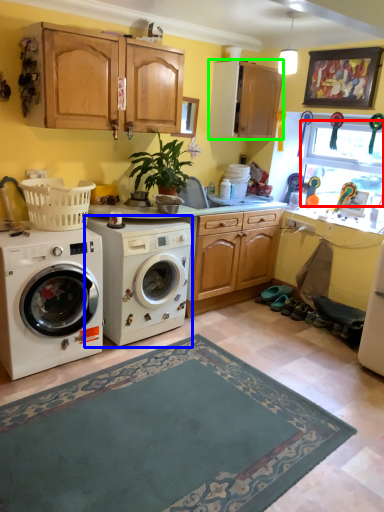
Question: Based on their relative distances, which object is farther from window screen (highlighted by a red box)? Choose from washing machine (highlighted by a blue box) and cabinetry (highlighted by a green box).

Choices:
 (A) washing machine
 (B) cabinetry

Answer: (A)